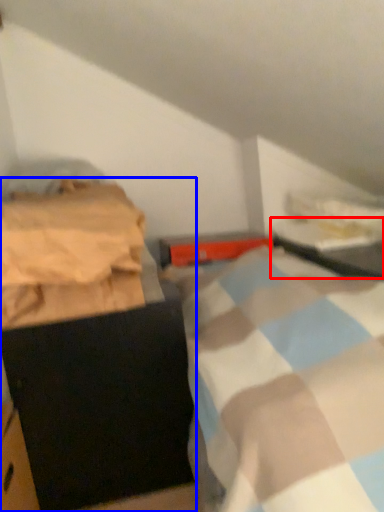
Question: Among these objects, which one is nearest to the camera, table (highlighted by a red box) or furniture (highlighted by a blue box)?

Choices:
 (A) table
 (B) furniture

Answer: (B)